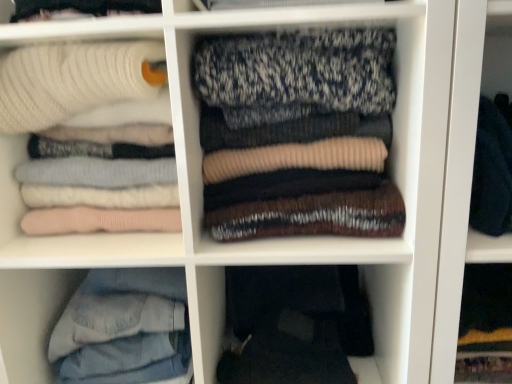
Question: Considering the relative positions of knit sweater at center, the first laundry from the right, and denim jeans at lower left in the image provided, is knit sweater at center, the first laundry from the right, to the right of denim jeans at lower left from the viewer's perspective?

Choices:
 (A) yes
 (B) no

Answer: (A)

Question: Considering the relative sizes of knit sweater at center, the first laundry from the right, and denim jeans at lower left in the image provided, is knit sweater at center, the first laundry from the right, thinner than denim jeans at lower left?

Choices:
 (A) yes
 (B) no

Answer: (A)

Question: From a real-world perspective, is knit sweater at center, which is the second laundry from left to right, below denim jeans at lower left?

Choices:
 (A) yes
 (B) no

Answer: (B)

Question: Is knit sweater at center, the first laundry from the right, not inside denim jeans at lower left?

Choices:
 (A) yes
 (B) no

Answer: (A)

Question: From a real-world perspective, is knit sweater at center, the first laundry from the right, located higher than denim jeans at lower left?

Choices:
 (A) no
 (B) yes

Answer: (B)

Question: Considering the relative positions of white ribbed sweater at upper left, the 2th laundry in the right-to-left sequence, and dark gray fabric pants at lower center in the image provided, is white ribbed sweater at upper left, the 2th laundry in the right-to-left sequence, to the left or to the right of dark gray fabric pants at lower center?

Choices:
 (A) right
 (B) left

Answer: (B)

Question: Considering the positions of point (71, 87) and point (344, 324), is point (71, 87) closer or farther from the camera than point (344, 324)?

Choices:
 (A) farther
 (B) closer

Answer: (B)

Question: Relative to dark gray fabric pants at lower center, is white ribbed sweater at upper left, placed as the 1th laundry when sorted from left to right, in front or behind?

Choices:
 (A) front
 (B) behind

Answer: (A)

Question: From a real-world perspective, is white ribbed sweater at upper left, the 2th laundry in the right-to-left sequence, physically located above or below dark gray fabric pants at lower center?

Choices:
 (A) above
 (B) below

Answer: (A)

Question: Is point tap(117, 342) closer or farther from the camera than point tap(222, 127)?

Choices:
 (A) farther
 (B) closer

Answer: (A)

Question: From a real-world perspective, is denim jeans at lower left above or below knit sweater at center, the first laundry from the right?

Choices:
 (A) above
 (B) below

Answer: (B)

Question: Considering the positions of denim jeans at lower left and knit sweater at center, which is the second laundry from left to right, in the image, is denim jeans at lower left wider or thinner than knit sweater at center, which is the second laundry from left to right,?

Choices:
 (A) thin
 (B) wide

Answer: (B)

Question: Is denim jeans at lower left spatially inside knit sweater at center, the first laundry from the right, or outside of it?

Choices:
 (A) outside
 (B) inside

Answer: (A)

Question: From a real-world perspective, is denim jeans at lower left positioned above or below white ribbed sweater at upper left, the 2th laundry in the right-to-left sequence?

Choices:
 (A) below
 (B) above

Answer: (A)

Question: Looking at their shapes, would you say denim jeans at lower left is wider or thinner than white ribbed sweater at upper left, the 2th laundry in the right-to-left sequence?

Choices:
 (A) wide
 (B) thin

Answer: (A)